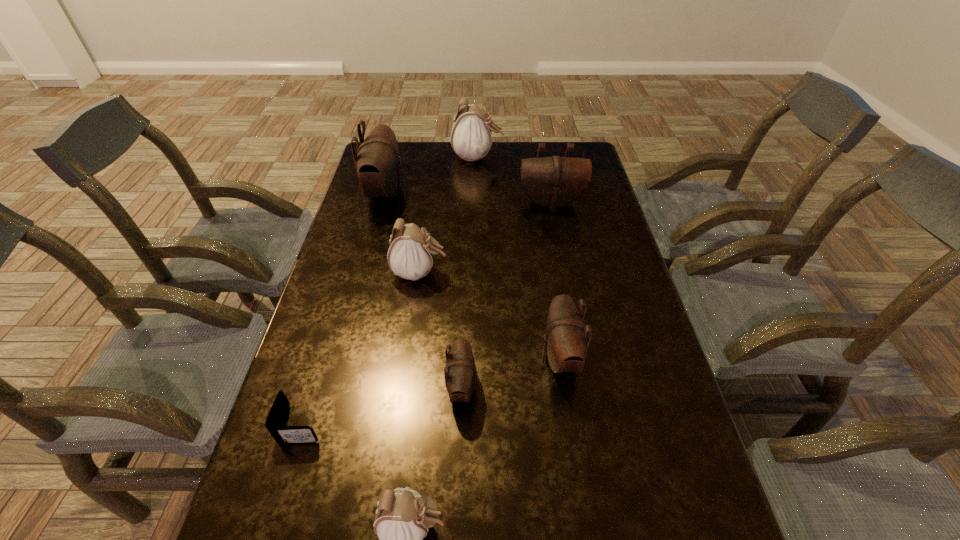
Where is `wallet that is at the left edge`? Image resolution: width=960 pixels, height=540 pixels. wallet that is at the left edge is located at coordinates (282, 434).

Find the location of a particular element. object at the right edge is located at coordinates (552, 182).

Find the location of a particular element. The width and height of the screenshot is (960, 540). object present at the far left corner is located at coordinates (377, 161).

You are a GUI agent. You are given a task and a screenshot of the screen. Output one action in this format:
    pyautogui.click(x=<x>, y=<y>)
    Task: Click on the blank space at the far edge of the desktop
    This screenshot has width=960, height=540.
    Given the screenshot: What is the action you would take?
    pyautogui.click(x=514, y=149)

Where is `free space at the left edge`? The image size is (960, 540). free space at the left edge is located at coordinates (348, 248).

This screenshot has height=540, width=960. What are the coordinates of `vacant space at the right edge of the desktop` in the screenshot? It's located at (696, 523).

Where is `free location at the far right corner`? free location at the far right corner is located at coordinates (551, 151).

This screenshot has width=960, height=540. In order to click on vacant area between the smallest brown pouch and the farthest object in this screenshot , I will do `click(469, 273)`.

Image resolution: width=960 pixels, height=540 pixels. In order to click on vacant space that is in between the biggest brown pouch and the third smallest brown pouch in this screenshot , I will do (x=468, y=198).

Identify the location of empty location between the third biggest brown pouch and the wallet. (431, 390).